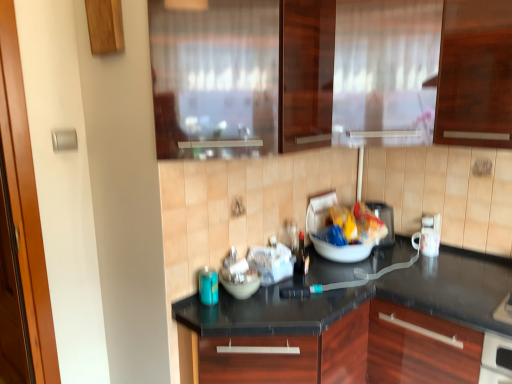
Image resolution: width=512 pixels, height=384 pixels. Find the location of `vacant area that is situated to the right of white glossy bowl at center`. vacant area that is situated to the right of white glossy bowl at center is located at coordinates (291, 298).